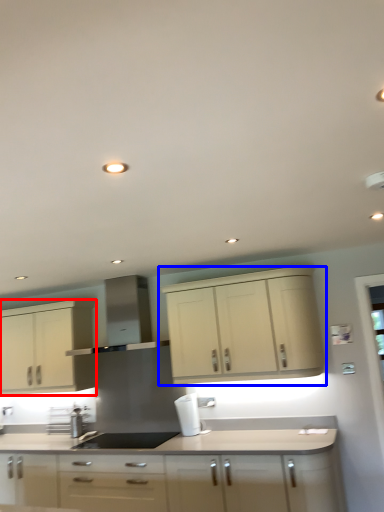
Question: Which object appears closest to the camera in this image, cabinetry (highlighted by a red box) or cabinetry (highlighted by a blue box)?

Choices:
 (A) cabinetry
 (B) cabinetry

Answer: (B)